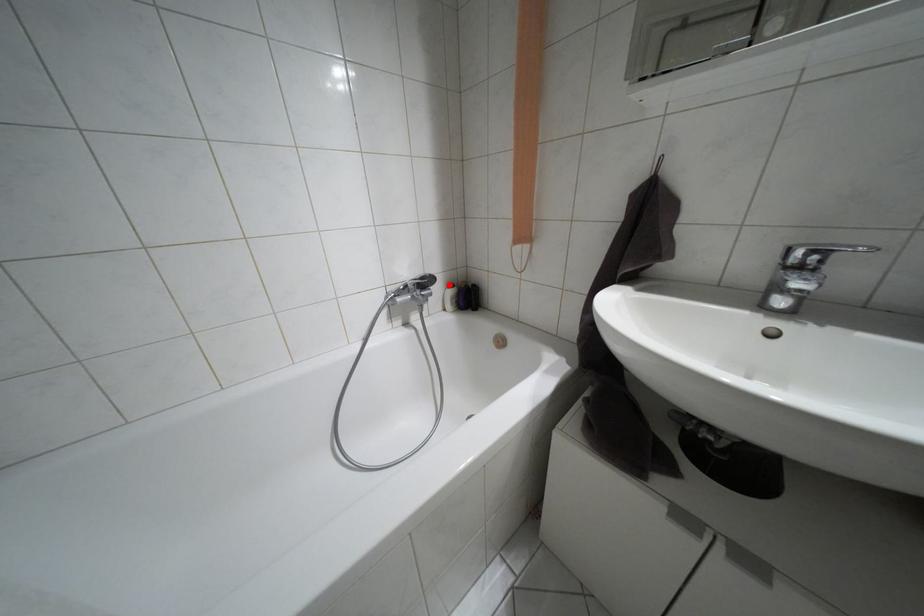
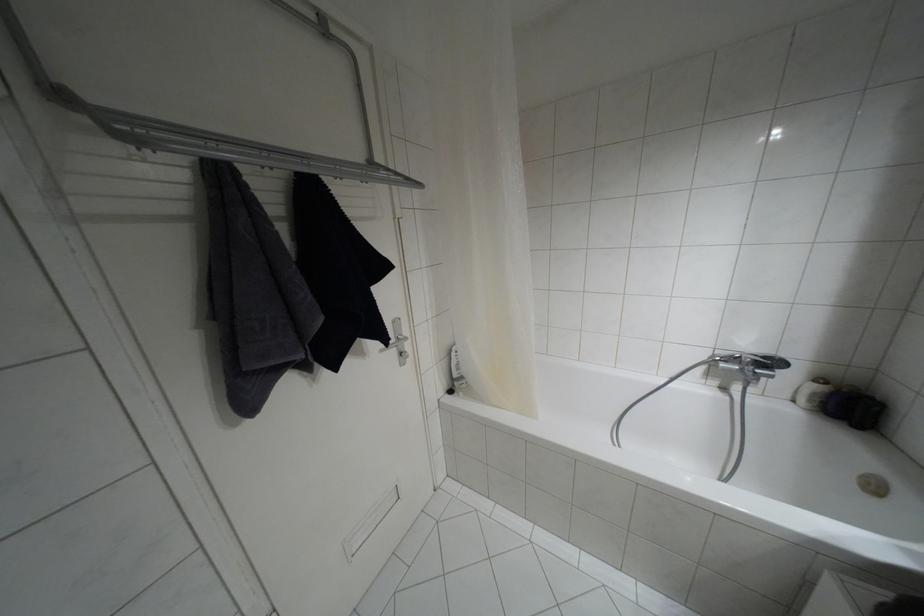
Locate, in the second image, the point that corresponds to the highlighted location in the first image.

(820, 379)